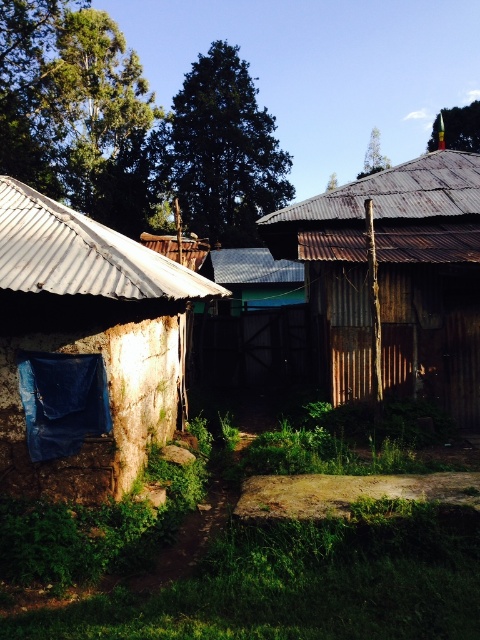
Question: Can you confirm if white stucco hut at left is bigger than rusty corrugated hut at center?

Choices:
 (A) no
 (B) yes

Answer: (A)

Question: Is rusty corrugated metal hut at center wider than rusty corrugated hut at center?

Choices:
 (A) yes
 (B) no

Answer: (A)

Question: Which object is closer to the camera taking this photo?

Choices:
 (A) white stucco hut at left
 (B) rusty corrugated metal hut at center

Answer: (B)

Question: Which point is farther to the camera?

Choices:
 (A) pos(104,449)
 (B) pos(67,419)
 (C) pos(440,312)
 (D) pos(304,232)

Answer: (D)

Question: Estimate the real-world distances between objects in this image. Which object is closer to the rusty corrugated hut at center?

Choices:
 (A) white stucco hut at left
 (B) blue tarp at lower left
 (C) rusty corrugated metal hut at center

Answer: (C)

Question: Is white stucco hut at left above blue tarp at lower left?

Choices:
 (A) yes
 (B) no

Answer: (A)